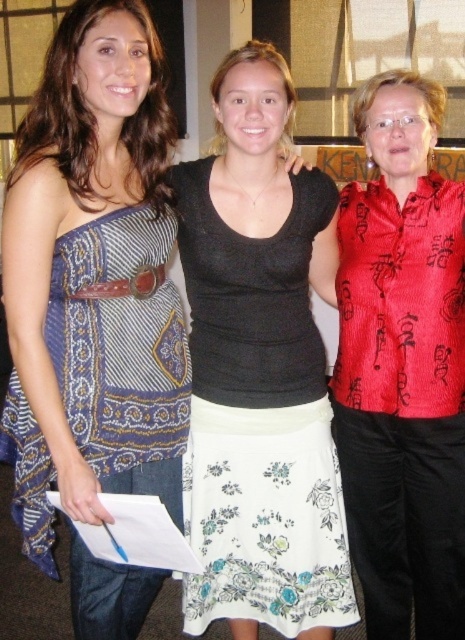
Question: Among these points, which one is farthest from the camera?

Choices:
 (A) (403, 552)
 (B) (59, 426)
 (C) (54, 300)
 (D) (265, 273)

Answer: (A)

Question: Is red corduroy vest at center to the right of blue printed fabric dress at left from the viewer's perspective?

Choices:
 (A) yes
 (B) no

Answer: (A)

Question: Which of the following is the farthest from the observer?

Choices:
 (A) matte black tank top at center
 (B) white floral skirt at center
 (C) red corduroy vest at center

Answer: (B)

Question: Does matte black tank top at center appear under red corduroy vest at center?

Choices:
 (A) yes
 (B) no

Answer: (B)

Question: Which point is farther from the camera taking this photo?

Choices:
 (A) (167, 432)
 (B) (93, 396)
 (C) (199, 273)
 (D) (431, 131)

Answer: (C)

Question: Can you confirm if red corduroy vest at center is wider than blue printed fabric dress at left?

Choices:
 (A) yes
 (B) no

Answer: (B)